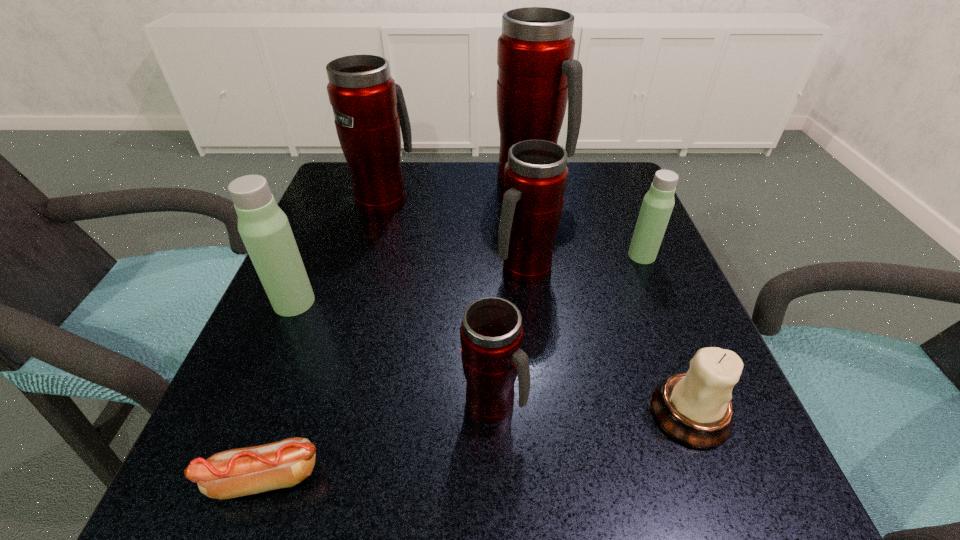
You are a GUI agent. You are given a task and a screenshot of the screen. Output one action in this format:
    pyautogui.click(x=<x>, y=<y>)
    Task: Click on the vacant space in between the shortest object and the leftmost red thermos bottle
    
    Given the screenshot: What is the action you would take?
    pyautogui.click(x=324, y=338)

Locate an element on the screen. This screenshot has height=540, width=960. vacant space that is in between the smallest red thermos bottle and the nearer light thermos bottle is located at coordinates (394, 353).

At what (x,y) coordinates should I click in order to perform the action: click on free space between the seventh shortest object and the nearer light thermos bottle. Please return your answer as a coordinate pair (x, y). The image size is (960, 540). Looking at the image, I should click on (339, 251).

Find the location of a particular element. This screenshot has height=540, width=960. free space between the nearest thermos bottle and the shortest object is located at coordinates (379, 441).

The width and height of the screenshot is (960, 540). Find the location of `empty space that is in between the tallest thermos bottle and the nearest thermos bottle`. empty space that is in between the tallest thermos bottle and the nearest thermos bottle is located at coordinates pyautogui.click(x=512, y=293).

Locate an element on the screen. This screenshot has height=540, width=960. free area in between the brown sausage and the left light thermos bottle is located at coordinates (279, 390).

The image size is (960, 540). In order to click on free spot between the candle holder and the second smallest red thermos bottle in this screenshot , I will do click(x=608, y=341).

Image resolution: width=960 pixels, height=540 pixels. What are the coordinates of `object that can be found as the sixth closest to the fifth thermos bottle from right to left` in the screenshot? It's located at (239, 472).

I want to click on object that is the seventh nearest to the shortest object, so pyautogui.click(x=537, y=75).

Identify which thermos bottle is the third nearest to the biggest red thermos bottle. Please provide its 2D coordinates. Your answer should be formatted as a tuple, i.e. [(x, y)], where the tuple contains the x and y coordinates of a point satisfying the conditions above.

[(658, 203)]